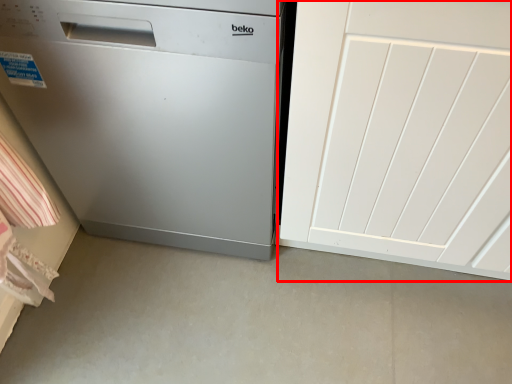
Question: Where is door (annotated by the red box) located in relation to home appliance in the image?

Choices:
 (A) right
 (B) left

Answer: (A)